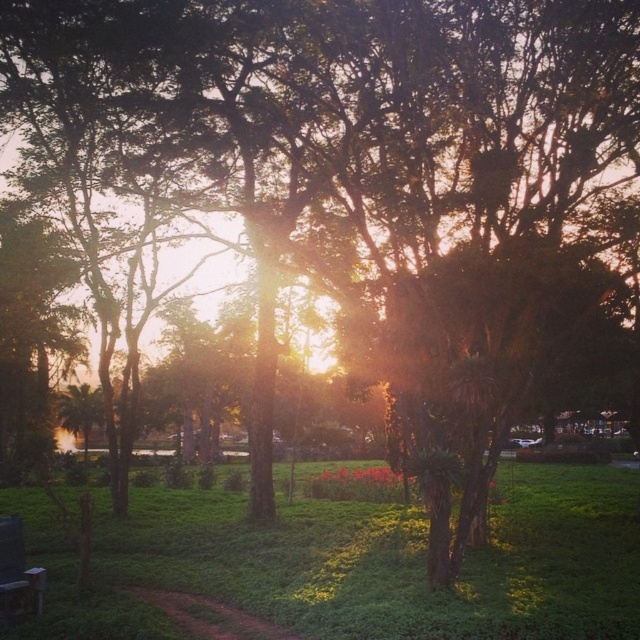
You are planning to set up a picnic in the park. You have a large blanket that can cover the green grassy at center and the wooden park bench at lower left. Which area should you place the blanket to ensure it covers both objects without overlapping?

The green grassy at center is larger in size than the wooden park bench at lower left, so placing the blanket over the green grassy at center would ensure it covers both objects without overlapping.

A child is standing on the green grassy at center and wants to throw a ball to their sibling who is standing 10.04 meters away. The sibling is somewhere in the park. Based on the scene description, where could the sibling be located?

The sibling could be near the lake in the background since the green grassy at center and the sibling are 10.04 meters apart.